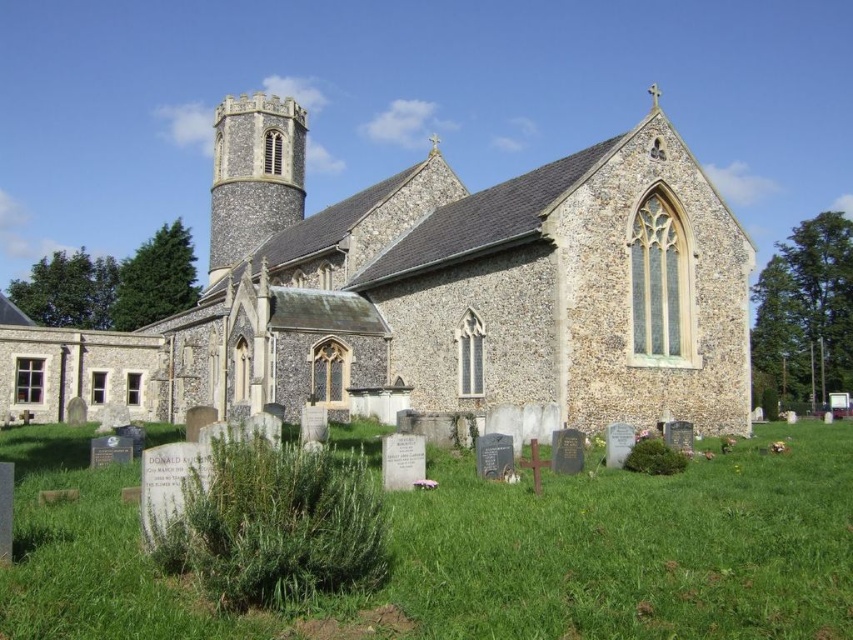
Does brown stone church at center have a greater height compared to green grass at lower center?

Yes.

Between point (657, 144) and point (807, 568), which one is positioned in front?

Point (807, 568) is in front.

Where is `brown stone church at center`? The height and width of the screenshot is (640, 853). brown stone church at center is located at coordinates click(x=433, y=292).